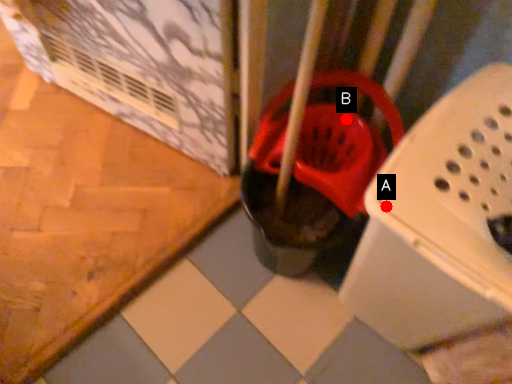
Question: Two points are circled on the image, labeled by A and B beside each circle. Which point appears farthest from the camera in this image?

Choices:
 (A) A is further
 (B) B is further

Answer: (B)